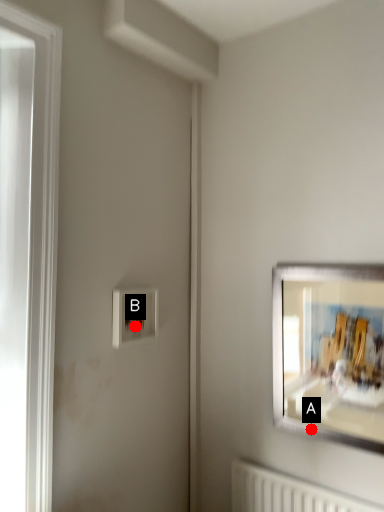
Question: Two points are circled on the image, labeled by A and B beside each circle. Which point is closer to the camera?

Choices:
 (A) A is closer
 (B) B is closer

Answer: (A)